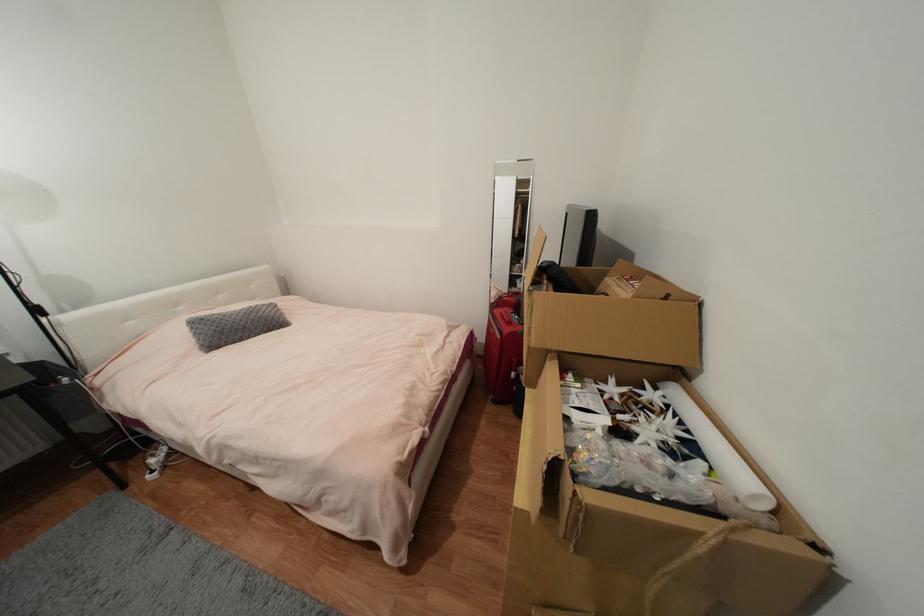
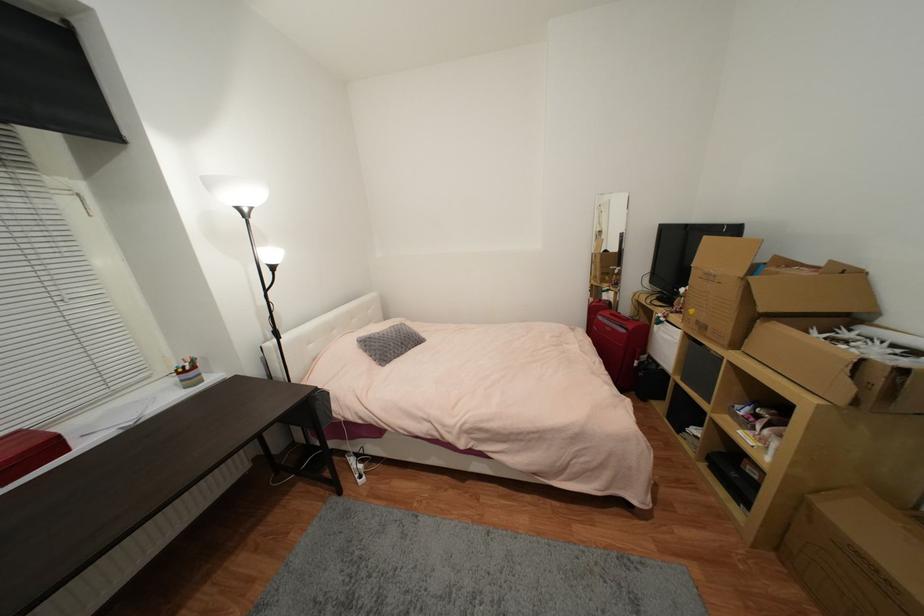
Locate, in the second image, the point that corresponds to the point at 199,317 in the first image.

(365, 338)